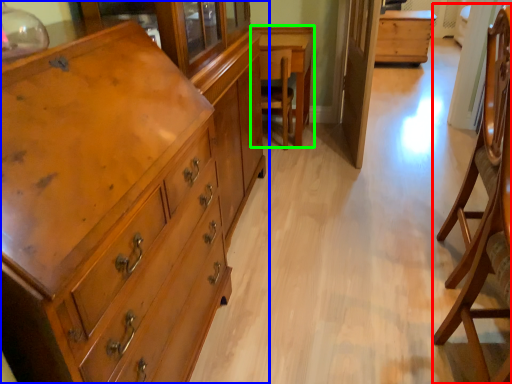
Question: Which is farther away from armchair (highlighted by a red box)? chest of drawers (highlighted by a blue box) or table (highlighted by a green box)?

Choices:
 (A) chest of drawers
 (B) table

Answer: (B)